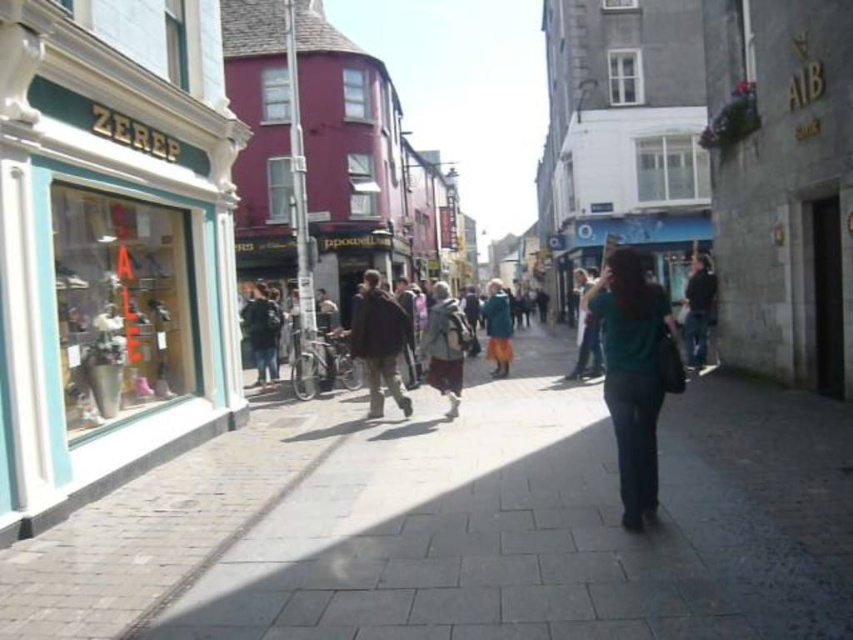
Consider the image. You are standing on the cobblestone street in front of the ZEREF storefront. There is a point marked at coordinates [111,248]. Based on the scene description, can you determine which object or feature this point corresponds to?

The point at coordinates [111,248] is located on the matte teal storefront at left.

You are a delivery person trying to park your bike on the brick pavement at center. However, there is a sign on the matte teal storefront at left that says,

The brick pavement at center is below the matte teal storefront at left, so the sign on the matte teal storefront at left is above the brick pavement at center. Therefore, the sign is visible from the brick pavement at center.

You are a delivery person trying to place a teal fabric shirt at center on the brick pavement at center. Will the shirt fit entirely on the pavement?

The brick pavement at center is smaller than the teal fabric shirt at center, so the shirt will not fit entirely on the pavement.